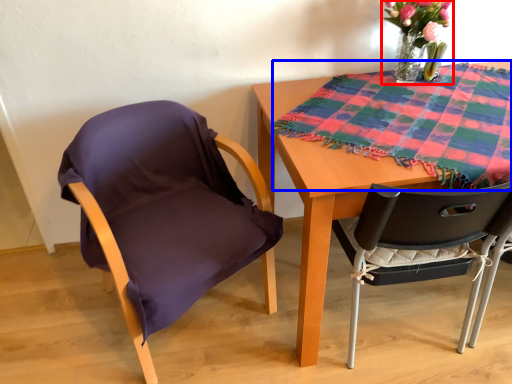
Question: Which object appears farthest to the camera in this image, floral arrangement (highlighted by a red box) or blanket (highlighted by a blue box)?

Choices:
 (A) floral arrangement
 (B) blanket

Answer: (A)